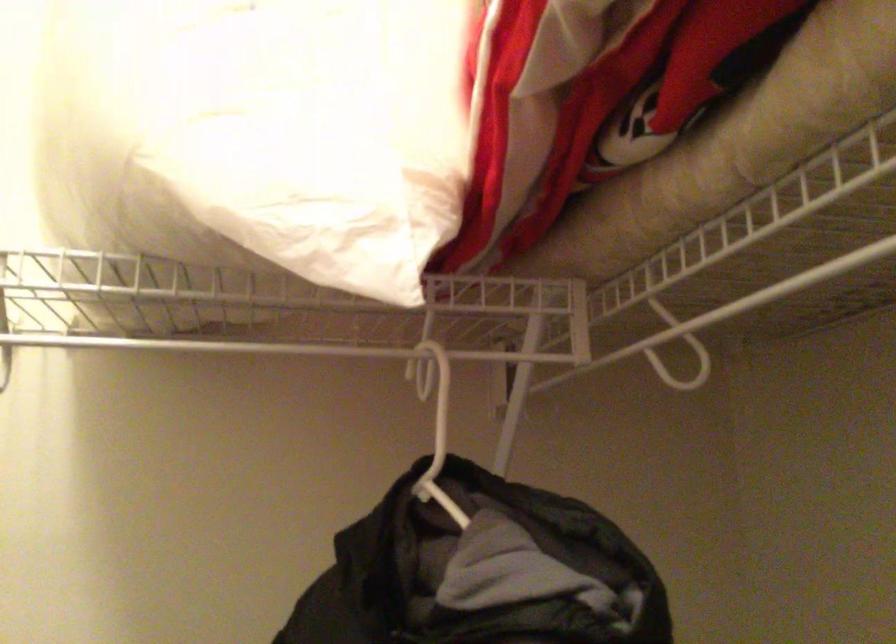
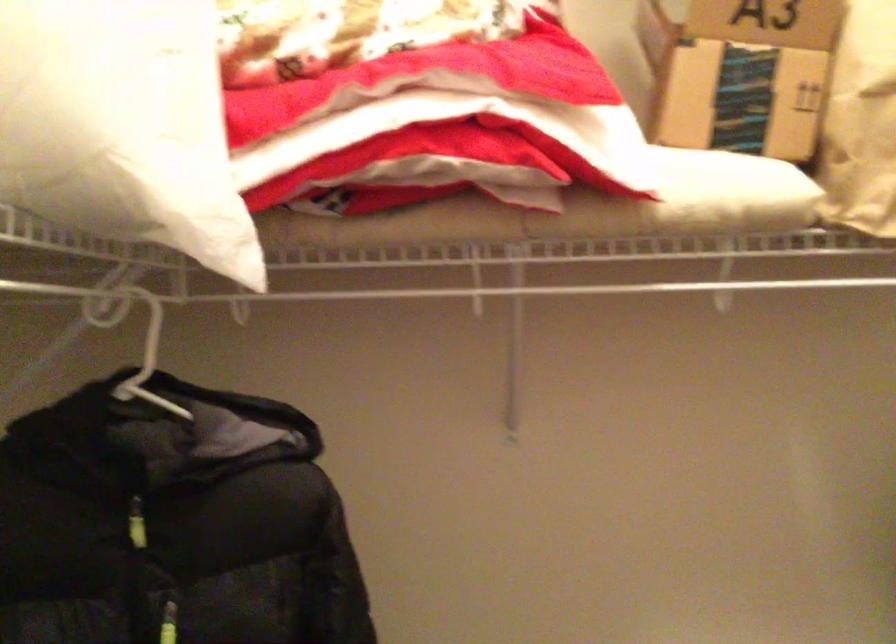
In the second image, find the point that corresponds to [784,448] in the first image.

(138, 344)